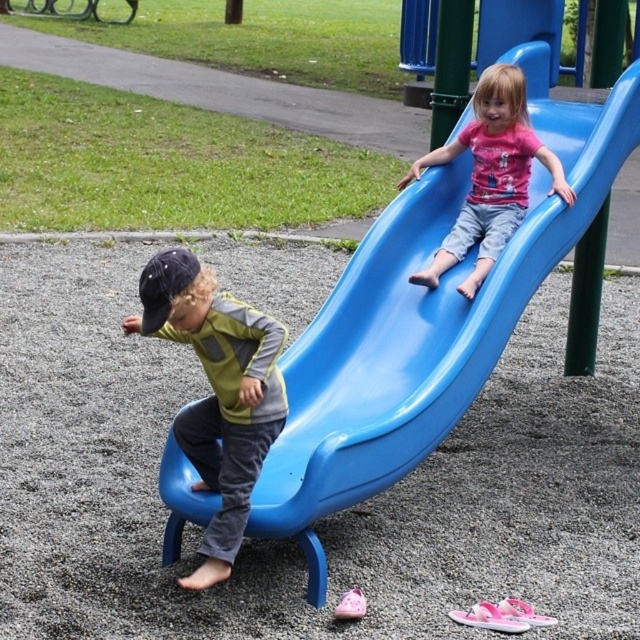
You are a parent at the playground and want to ensure your child can see the slide from where they are standing. The child is wearing a matte pink shirt at upper center. Is the glossy plastic slide at upper right visible from their position?

The glossy plastic slide at upper right is much taller than the matte pink shirt at upper center, so the slide would likely be visible from the position of the matte pink shirt at upper center as it is elevated higher.

You are a parent at the playground and want to ensure the children are safe. Which clothing item, the matte green vest at center or the matte pink shirt at upper center, is positioned higher up on the slide to indicate the child is closer to the top?

The matte pink shirt at upper center is positioned higher up on the slide than the matte green vest at center, indicating the child wearing it is closer to the top.

You are a parent at the playground and want to ensure the safety of the children. Based on the image, which child is closer to the top of the slide, the one wearing the matte green vest at center or the matte pink shirt at upper center?

The matte pink shirt at upper center is closer to the top of the slide because the matte green vest at center is positioned under it.